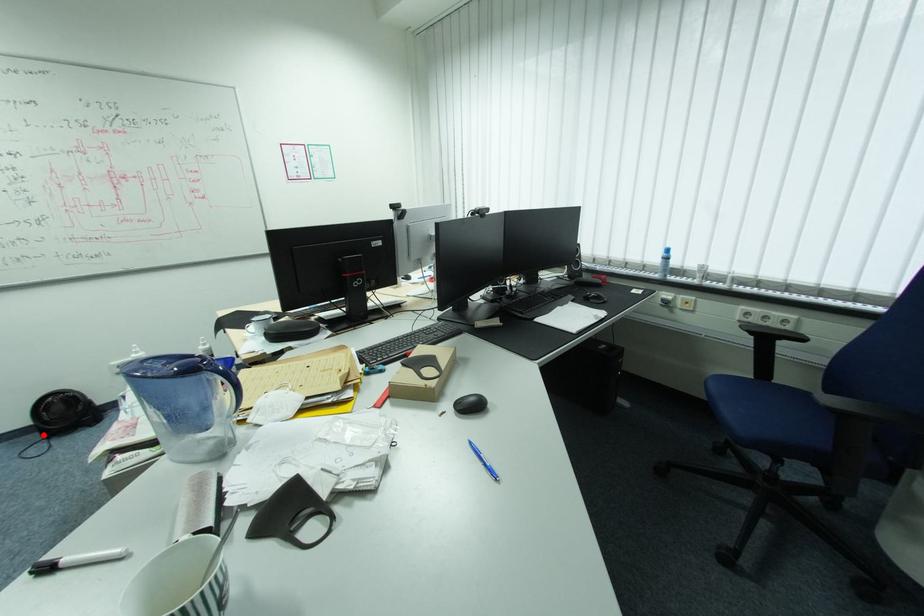
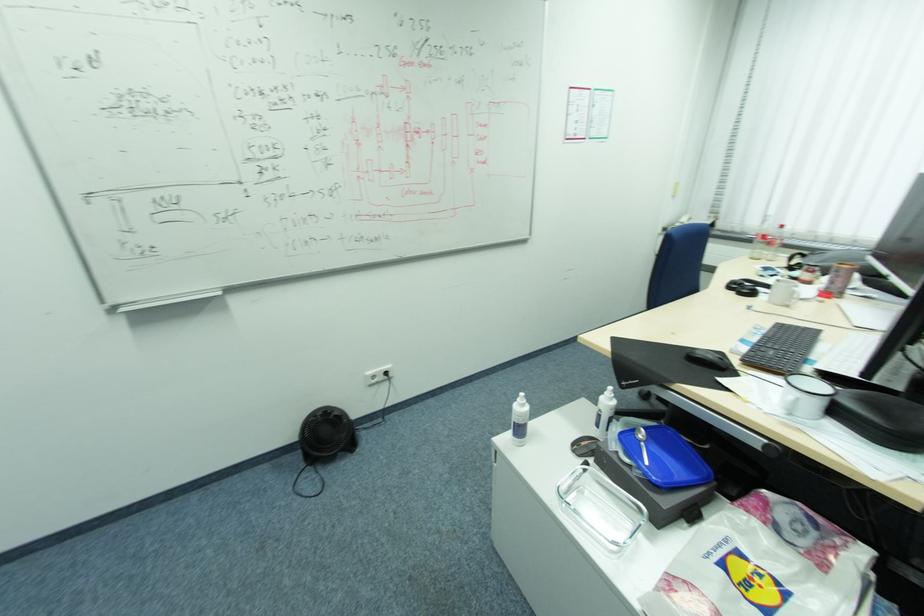
Question: I am providing you with two images of the same scene from different viewpoints. Given a red point in image1, look at the same physical point in image2. Is it:

Choices:
 (A) Closer to the viewpoint
 (B) Farther from the viewpoint

Answer: (B)